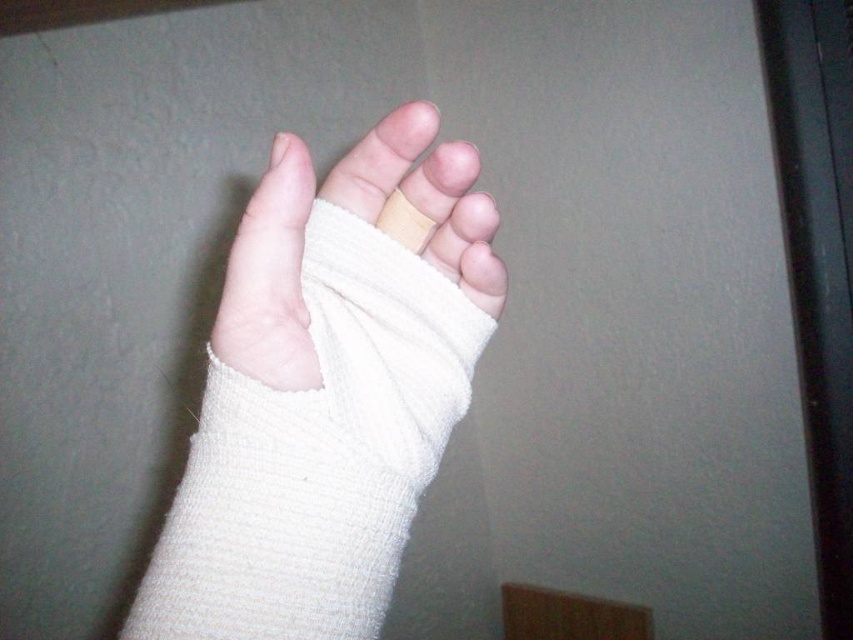
You are a nurse checking a patient. You see the white textured bandage at center and the white bandage at center. Which one is positioned more to the left?

The white textured bandage at center is positioned more to the left than the white bandage at center.

You are a nurse checking a patient. You see the white textured bandage at center and the white bandage at center. Which one is closer to the patient?

Both the white textured bandage at center and the white bandage at center are the same bandage, so they are at the same distance from the patient.

Consider the image. You are a nurse checking a patient with a hand injury. You see two bandages on the patient. The first is a white textured bandage at center, and the second is a white bandage at center. Which bandage is larger?

The white textured bandage at center is bigger than the white bandage at center, so the white textured bandage at center is larger.